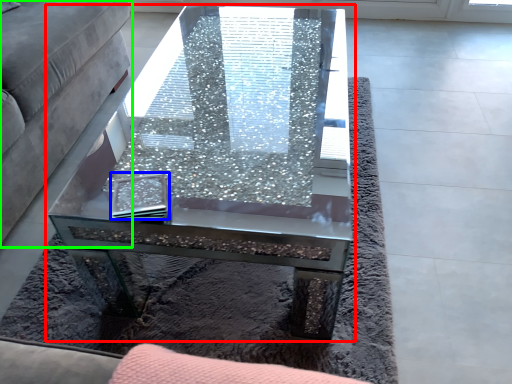
Question: Which object is positioned farthest from coffee table (highlighted by a red box)? Select from pad (highlighted by a blue box) and studio couch (highlighted by a green box).

Choices:
 (A) pad
 (B) studio couch

Answer: (B)